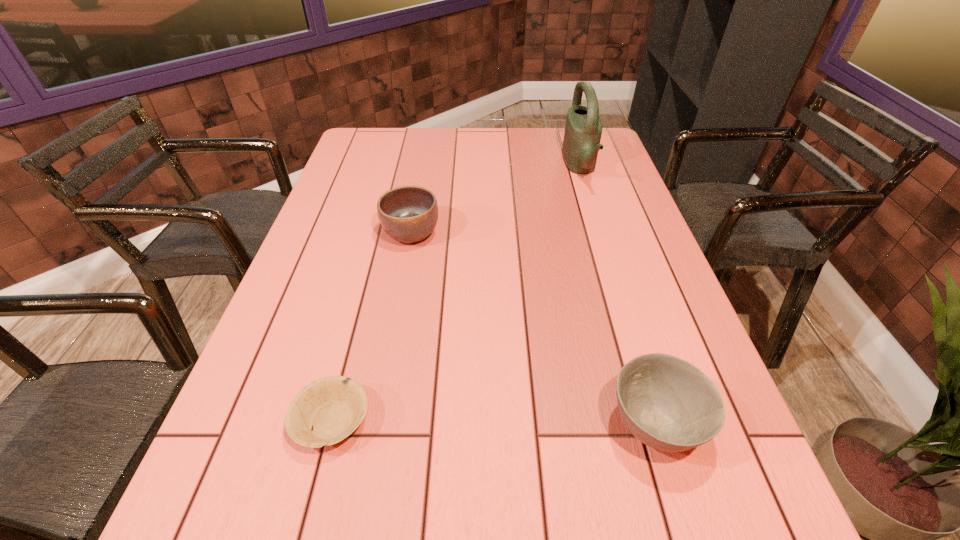
This screenshot has height=540, width=960. Find the location of `watering can`. watering can is located at coordinates (583, 129).

This screenshot has width=960, height=540. In order to click on the farthest object in this screenshot , I will do `click(583, 129)`.

Find the location of a particular element. This screenshot has width=960, height=540. the third nearest object is located at coordinates (408, 214).

Image resolution: width=960 pixels, height=540 pixels. I want to click on the rightmost bowl, so click(667, 403).

This screenshot has width=960, height=540. I want to click on the shortest object, so (333, 407).

Find the location of `vacant space situated on the spout of the watering can`. vacant space situated on the spout of the watering can is located at coordinates (463, 166).

Identify the location of free space located on the spout of the watering can. The height and width of the screenshot is (540, 960). (472, 166).

This screenshot has width=960, height=540. What are the coordinates of `free space located 0.400m on the spout of the watering can` in the screenshot? It's located at (445, 166).

What are the coordinates of `vacant space situated on the right of the farthest bowl` in the screenshot? It's located at [x=560, y=234].

This screenshot has width=960, height=540. What are the coordinates of `free point located on the left of the rightmost bowl` in the screenshot? It's located at (536, 426).